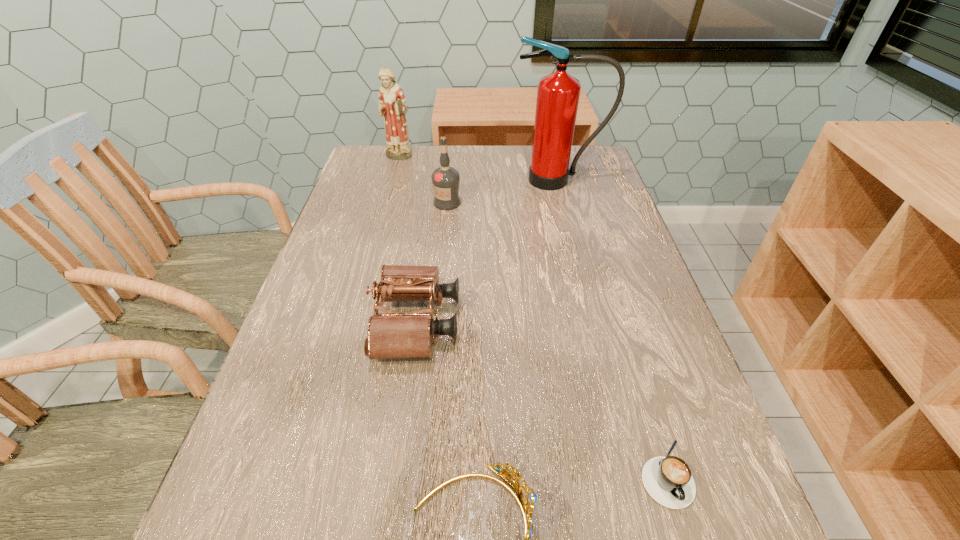
I want to click on the tallest object, so click(x=558, y=93).

Identify the location of the second farthest object. (x=558, y=93).

What are the coordinates of `the leftmost object` in the screenshot? It's located at (392, 103).

Locate an element on the screen. The width and height of the screenshot is (960, 540). the farthest object is located at coordinates (392, 103).

This screenshot has height=540, width=960. I want to click on the third tallest object, so (x=445, y=179).

This screenshot has height=540, width=960. In order to click on the fourth nearest object in this screenshot , I will do `click(445, 179)`.

You are a GUI agent. You are given a task and a screenshot of the screen. Output one action in this format:
    pyautogui.click(x=<x>, y=<y>)
    Task: Click on the third nearest object
    This screenshot has width=960, height=540.
    Given the screenshot: What is the action you would take?
    pyautogui.click(x=394, y=334)

Where is `cappuccino`? cappuccino is located at coordinates (668, 480).

I want to click on vacant space located 0.190m on the left of the tallest object, so click(449, 180).

This screenshot has height=540, width=960. In order to click on free space located 0.160m on the front-facing side of the leftmost object in this screenshot , I will do `click(389, 193)`.